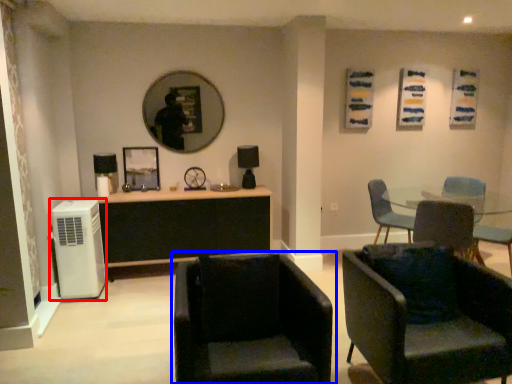
Question: Which object appears closest to the camera in this image, air conditioning (highlighted by a red box) or chair (highlighted by a blue box)?

Choices:
 (A) air conditioning
 (B) chair

Answer: (B)